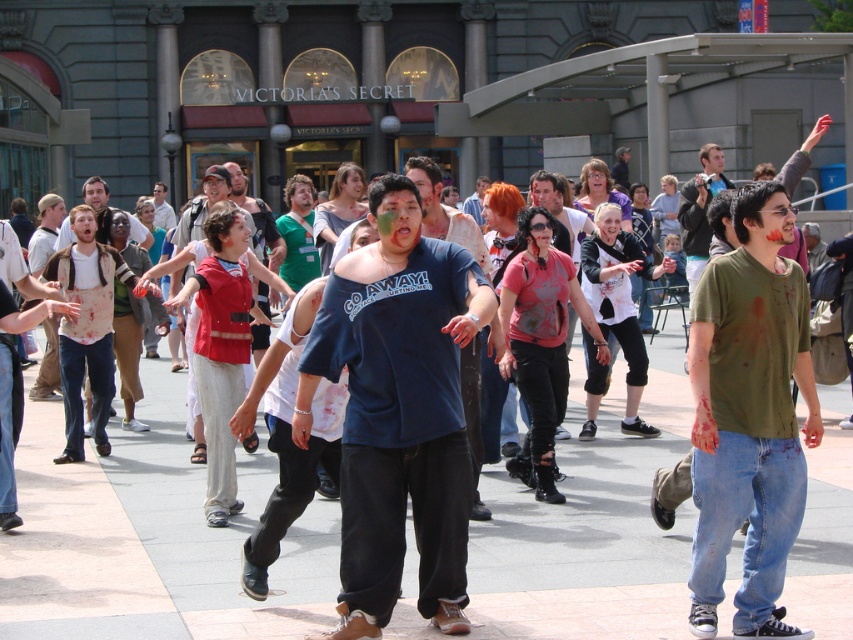
Is dark blue t-shirt at center smaller than green matte shirt at center?

No, dark blue t-shirt at center is not smaller than green matte shirt at center.

Is dark blue t-shirt at center thinner than green matte shirt at center?

In fact, dark blue t-shirt at center might be wider than green matte shirt at center.

Is point (416, 468) more distant than point (752, 355)?

That is True.

This screenshot has height=640, width=853. In order to click on dark blue t-shirt at center in this screenshot , I will do `click(398, 410)`.

Looking at this image, is the position of dark blue t-shirt at center more distant than that of red fabric vest at center?

No, it is in front of red fabric vest at center.

Between point (346, 592) and point (189, 406), which one is positioned in front?

Positioned in front is point (346, 592).

This screenshot has height=640, width=853. What do you see at coordinates (398, 410) in the screenshot?
I see `dark blue t-shirt at center` at bounding box center [398, 410].

In order to click on dark blue t-shirt at center in this screenshot , I will do `click(398, 410)`.

Between green matte shirt at center and red fabric vest at center, which one appears on the right side from the viewer's perspective?

green matte shirt at center

Is green matte shirt at center to the right of red fabric vest at center from the viewer's perspective?

Indeed, green matte shirt at center is positioned on the right side of red fabric vest at center.

You are a GUI agent. You are given a task and a screenshot of the screen. Output one action in this format:
    pyautogui.click(x=<x>, y=<y>)
    Task: Click on the green matte shirt at center
    
    Given the screenshot: What is the action you would take?
    pyautogui.click(x=749, y=417)